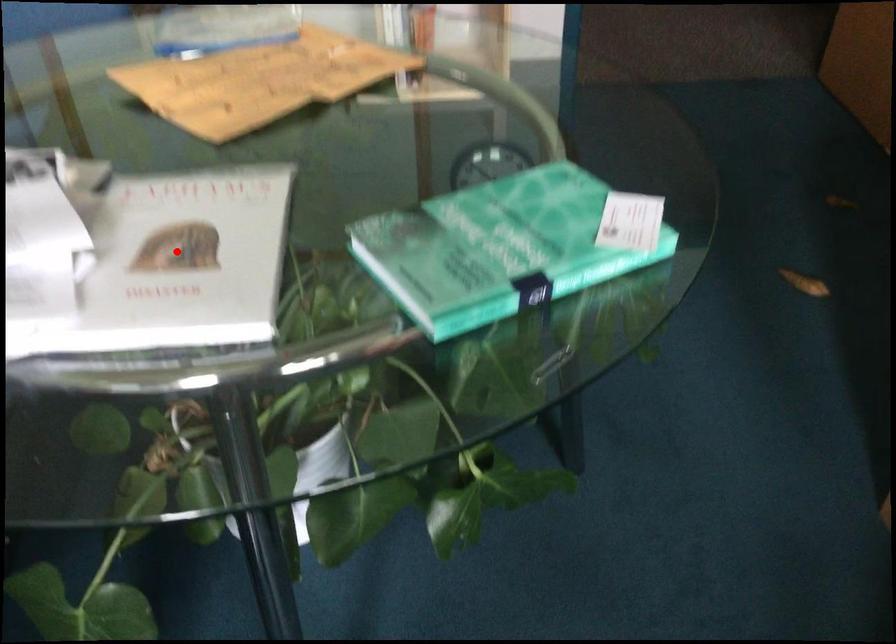
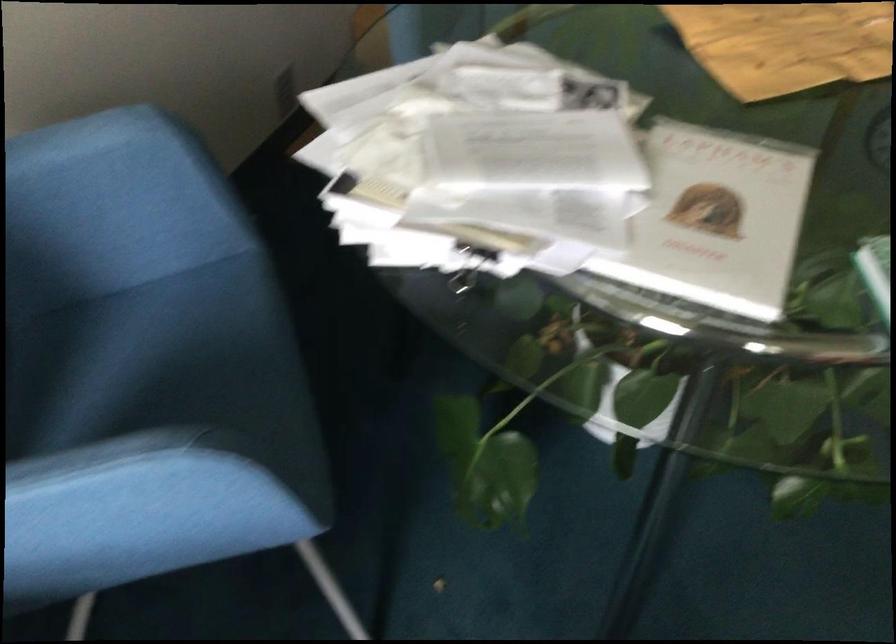
Question: I am providing you with two images of the same scene from different viewpoints. A red point is marked on the first image. Is the red point's position out of view in image 2?

Choices:
 (A) Yes
 (B) No

Answer: (B)